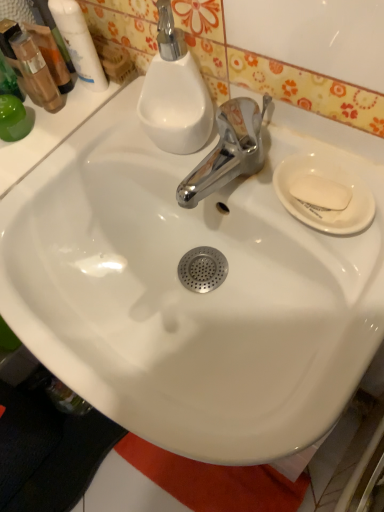
This screenshot has height=512, width=384. Identify the location of free space on the front side of white glossy mouthwash at upper left, acting as the second mouthwash starting from the left. (102, 146).